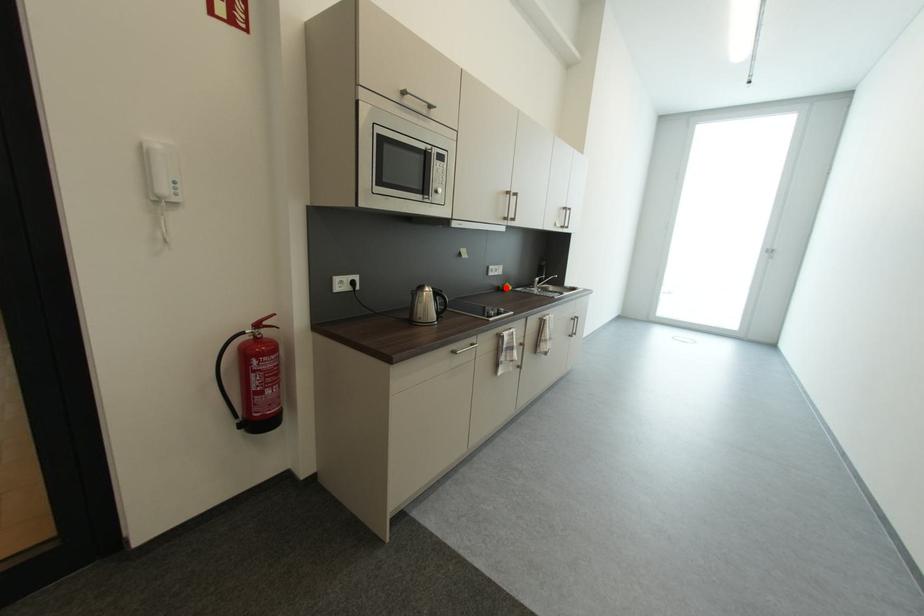
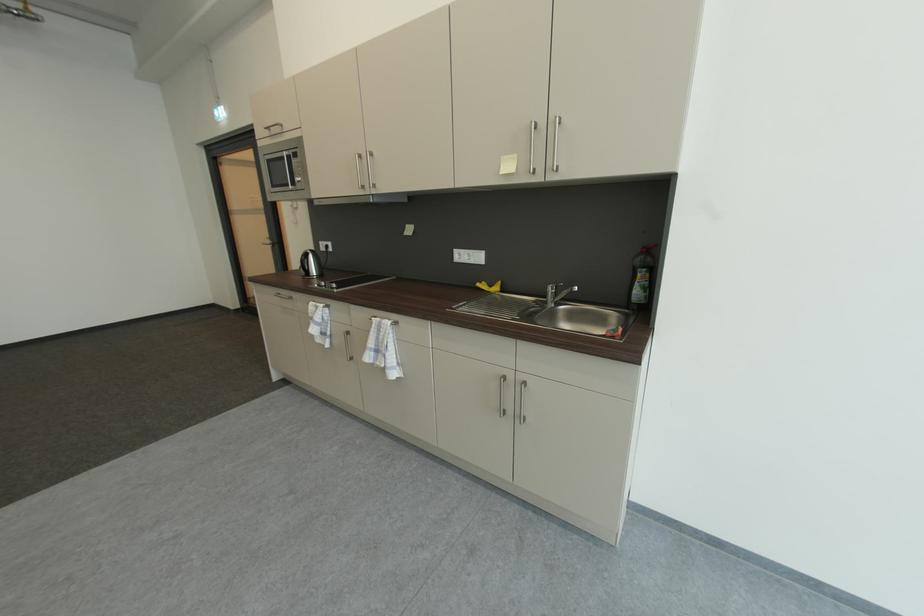
Locate, in the second image, the point that corresponds to the highlighted location in the first image.

(487, 284)